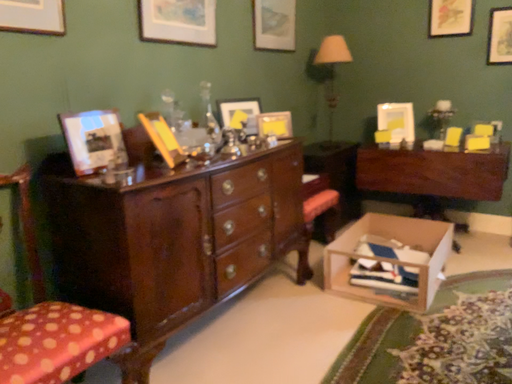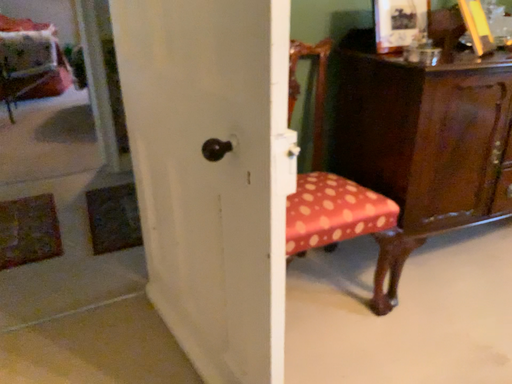
Question: How did the camera likely rotate when shooting the video?

Choices:
 (A) rotated right
 (B) rotated left

Answer: (B)